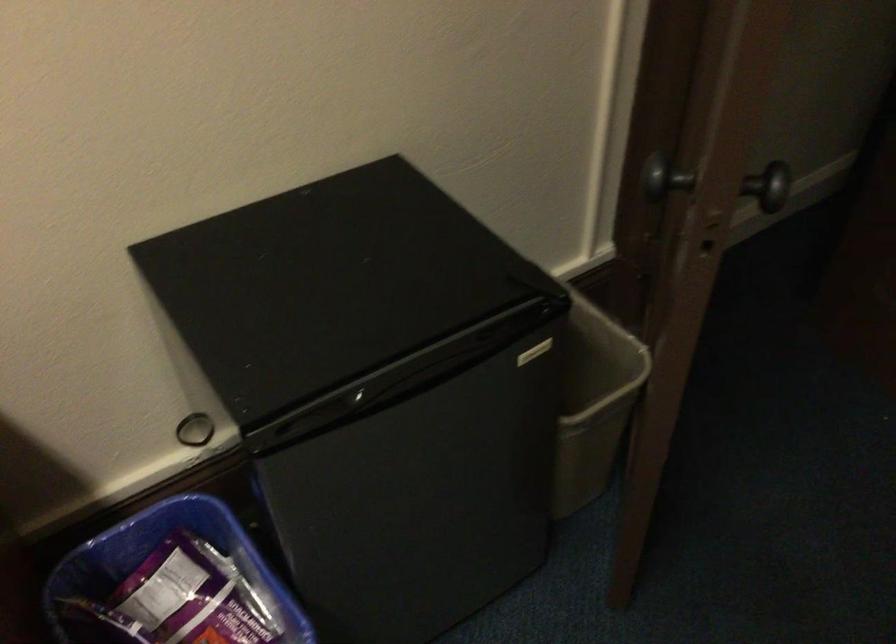
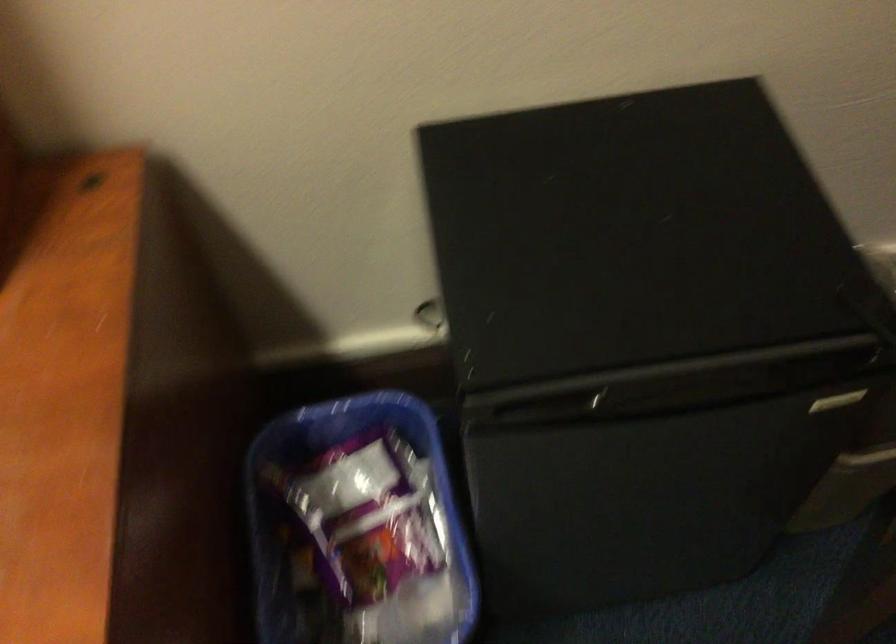
Question: The camera is either moving clockwise (left) or counter-clockwise (right) around the object. The first image is from the beginning of the video and the second image is from the end. Is the camera moving left or right when shooting the video?

Choices:
 (A) Left
 (B) Right

Answer: (B)